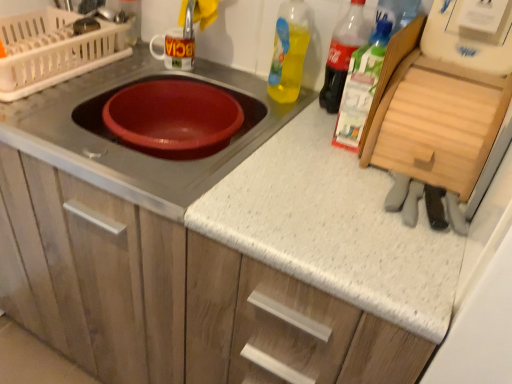
Question: Can you confirm if matte plastic dish drainer at upper left is positioned to the left of translucent plastic bottle at upper right, which is the first bottle from right to left?

Choices:
 (A) no
 (B) yes

Answer: (B)

Question: From the image's perspective, does matte plastic dish drainer at upper left appear lower than translucent plastic bottle at upper right, which is the first bottle from right to left?

Choices:
 (A) yes
 (B) no

Answer: (B)

Question: Does matte plastic dish drainer at upper left have a lesser height compared to translucent plastic bottle at upper right, which is the first bottle from right to left?

Choices:
 (A) yes
 (B) no

Answer: (A)

Question: Is translucent plastic bottle at upper right, placed as the third bottle when sorted from left to right, at the back of matte plastic dish drainer at upper left?

Choices:
 (A) yes
 (B) no

Answer: (B)

Question: Is matte plastic dish drainer at upper left facing towards translucent plastic bottle at upper right, placed as the third bottle when sorted from left to right?

Choices:
 (A) yes
 (B) no

Answer: (B)

Question: Is matte red bowl at center wider or thinner than translucent plastic bottle at upper right, positioned as the second bottle in right-to-left order?

Choices:
 (A) wide
 (B) thin

Answer: (A)

Question: Is matte red bowl at center spatially inside translucent plastic bottle at upper right, positioned as the second bottle in right-to-left order, or outside of it?

Choices:
 (A) outside
 (B) inside

Answer: (A)

Question: Considering the positions of matte red bowl at center and translucent plastic bottle at upper right, arranged as the 2th bottle when viewed from the left, in the image, is matte red bowl at center bigger or smaller than translucent plastic bottle at upper right, arranged as the 2th bottle when viewed from the left,?

Choices:
 (A) small
 (B) big

Answer: (B)

Question: Is matte red bowl at center taller or shorter than translucent plastic bottle at upper right, positioned as the second bottle in right-to-left order?

Choices:
 (A) short
 (B) tall

Answer: (A)

Question: Considering the positions of translucent plastic bottle at upper right, arranged as the 2th bottle when viewed from the left, and translucent plastic bottle at upper right, which is the first bottle from right to left, in the image, is translucent plastic bottle at upper right, arranged as the 2th bottle when viewed from the left, taller or shorter than translucent plastic bottle at upper right, which is the first bottle from right to left,?

Choices:
 (A) short
 (B) tall

Answer: (B)

Question: Considering the positions of translucent plastic bottle at upper right, positioned as the second bottle in right-to-left order, and translucent plastic bottle at upper right, which is the first bottle from right to left, in the image, is translucent plastic bottle at upper right, positioned as the second bottle in right-to-left order, wider or thinner than translucent plastic bottle at upper right, which is the first bottle from right to left,?

Choices:
 (A) wide
 (B) thin

Answer: (A)

Question: Considering their positions, is translucent plastic bottle at upper right, arranged as the 2th bottle when viewed from the left, located in front of or behind translucent plastic bottle at upper right, which is the first bottle from right to left?

Choices:
 (A) behind
 (B) front

Answer: (A)

Question: Is point (337, 81) closer or farther from the camera than point (377, 31)?

Choices:
 (A) closer
 (B) farther

Answer: (B)

Question: From the image's perspective, is translucent plastic bottle at upper right, which is the first bottle from right to left, above or below matte white cabinet at center?

Choices:
 (A) below
 (B) above

Answer: (B)

Question: In terms of size, does translucent plastic bottle at upper right, which is the first bottle from right to left, appear bigger or smaller than matte white cabinet at center?

Choices:
 (A) small
 (B) big

Answer: (A)